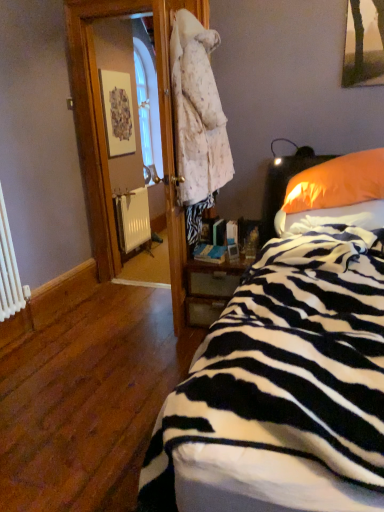
Question: Would you say wooden picture frame at upper left is inside or outside wooden nightstand at center?

Choices:
 (A) outside
 (B) inside

Answer: (A)

Question: From the image's perspective, is wooden picture frame at upper left above or below wooden nightstand at center?

Choices:
 (A) below
 (B) above

Answer: (B)

Question: Which is nearer to the zebra-patterned fabric at right?

Choices:
 (A) orange fabric pillow at right
 (B) wooden picture frame at upper left
 (C) wooden nightstand at center
 (D) zebra-patterned fabric at lower right
 (E) white matte radiator at lower left

Answer: (A)

Question: Which is farther from the orange fabric pillow at right?

Choices:
 (A) white matte radiator at lower left
 (B) zebra-patterned fabric at lower right
 (C) wooden picture frame at upper left
 (D) wooden nightstand at center
 (E) zebra-patterned fabric at right

Answer: (C)